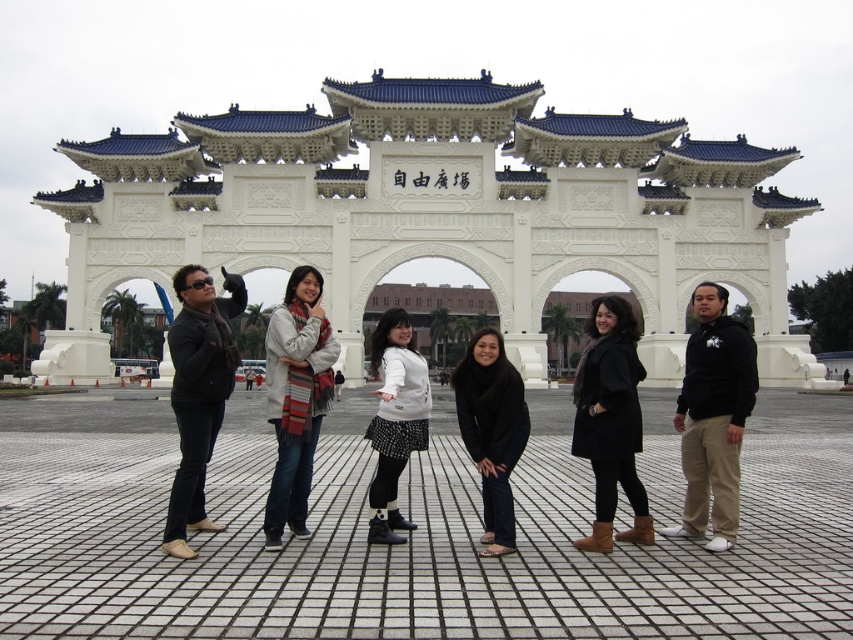
You are a photographer trying to capture the group photo of the six individuals in front of the archway. You notice the black matte coat at center and the striped scarf at center. Which item is shorter in length?

The black matte coat at center is shorter than the striped scarf at center.

You are a photographer trying to capture a closeup of the striped scarf at center and the white matte sweater at center. Which one will appear bigger in your photo?

The striped scarf at center is larger in size than the white matte sweater at center, so it will appear bigger in the photo.